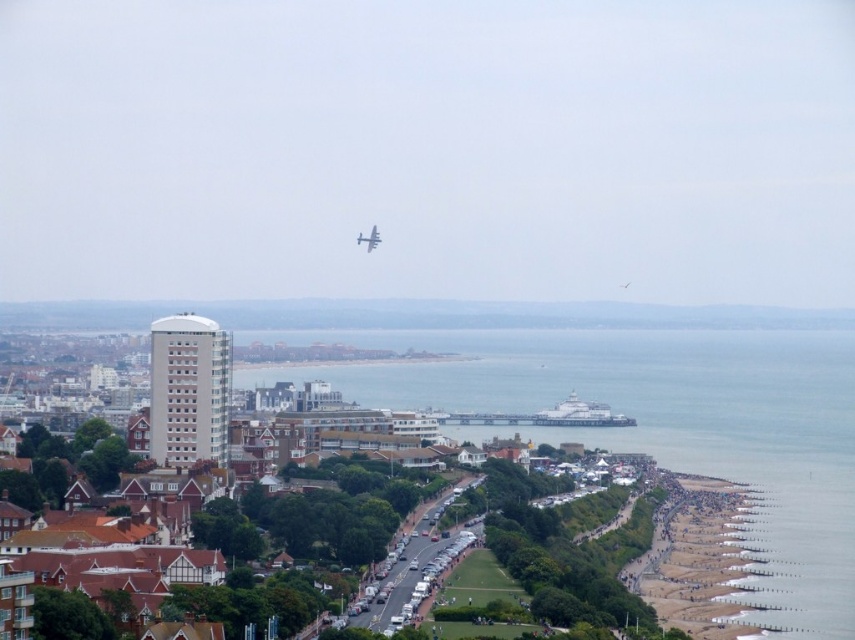
Question: Can you confirm if clear blue water at beach right is smaller than metallic silver airplane at center?

Choices:
 (A) yes
 (B) no

Answer: (B)

Question: Which object appears closest to the camera in this image?

Choices:
 (A) metallic silver airplane at center
 (B) clear blue water at beach right

Answer: (A)

Question: Can you confirm if clear blue water at beach right is positioned below metallic silver airplane at center?

Choices:
 (A) no
 (B) yes

Answer: (B)

Question: Can you confirm if clear blue water at beach right is positioned above metallic silver airplane at center?

Choices:
 (A) yes
 (B) no

Answer: (B)